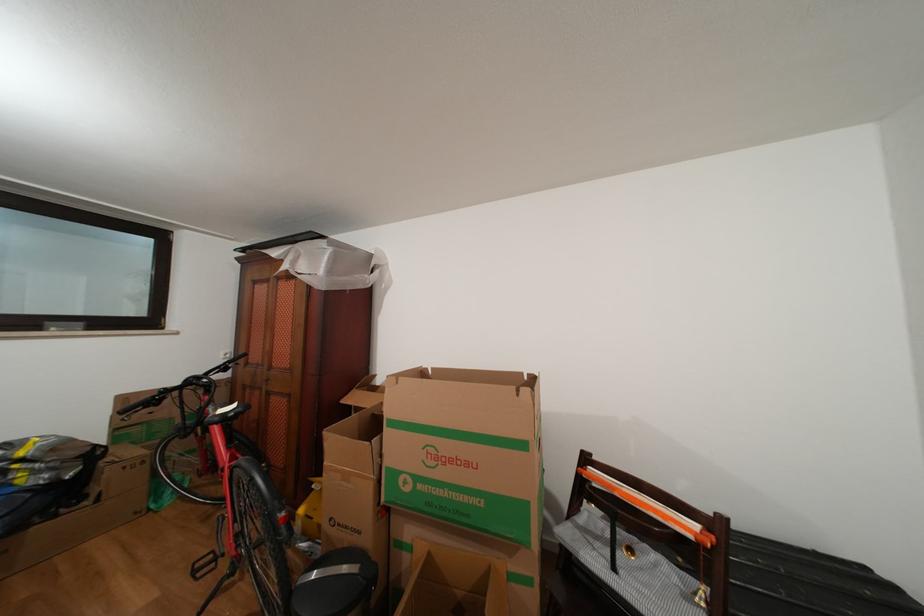
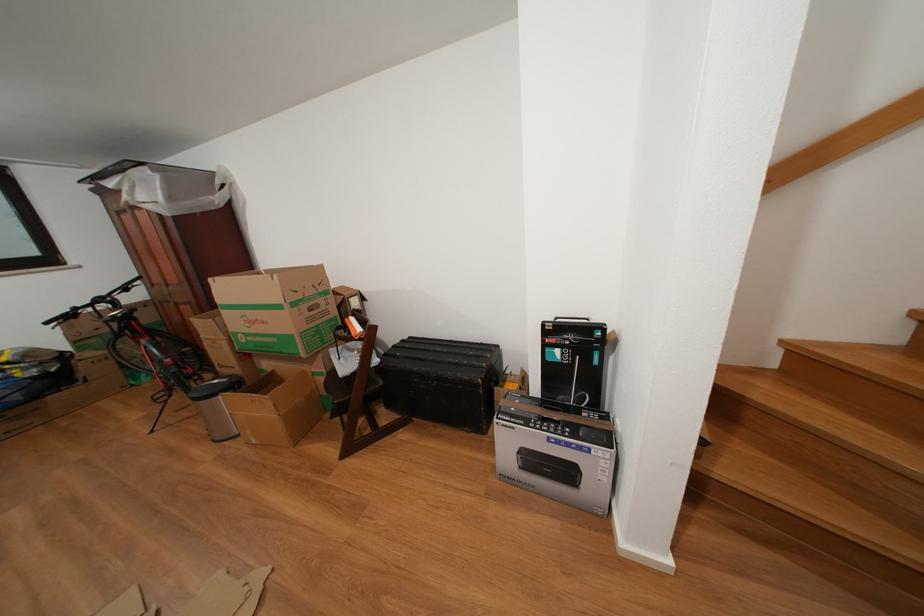
Based on the photo, what movement of the cameraman would produce the second image?

The cameraman moved toward right, backward.